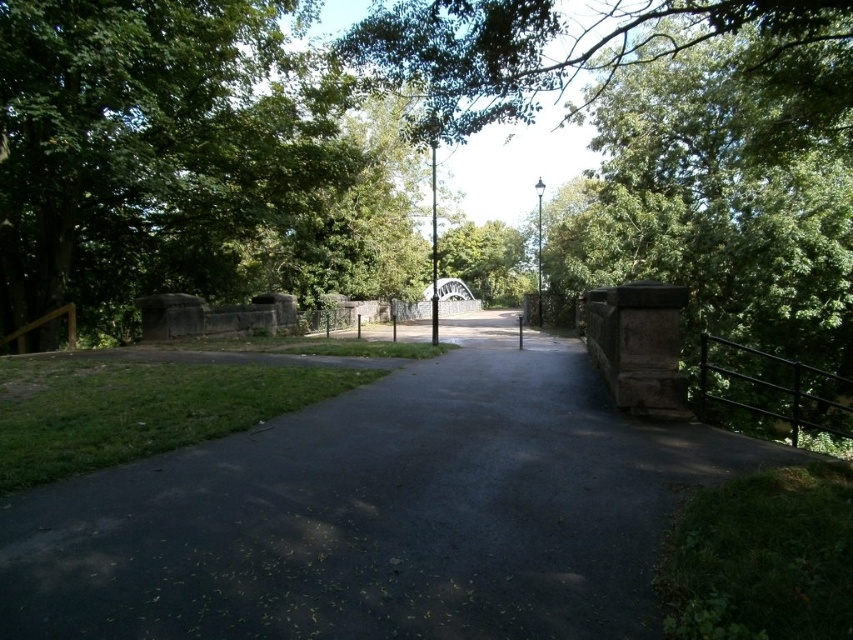
Is dark asphalt path at center behind green leafy tree at upper center?

No, it is not.

Which is behind, point (225, 564) or point (428, 49)?

Positioned behind is point (428, 49).

Locate an element on the screen. This screenshot has width=853, height=640. dark asphalt path at center is located at coordinates (380, 513).

Is dark asphalt path at center taller than green leafy tree at left?

Yes, dark asphalt path at center is taller than green leafy tree at left.

This screenshot has width=853, height=640. I want to click on dark asphalt path at center, so click(380, 513).

Is point (369, 621) closer to camera compared to point (239, 186)?

That is True.

Where is `dark asphalt path at center`? This screenshot has width=853, height=640. dark asphalt path at center is located at coordinates click(x=380, y=513).

Describe the element at coordinates (151, 145) in the screenshot. I see `green leafy tree at left` at that location.

This screenshot has height=640, width=853. Identify the location of green leafy tree at left. (x=151, y=145).